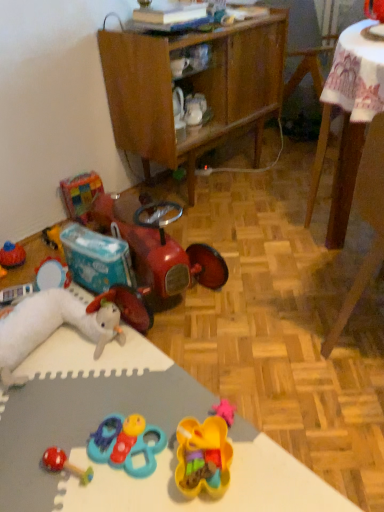
I want to click on free spot in front of rubberized red car at lower left, placed as the fourth toy when sorted from right to left, so click(173, 374).